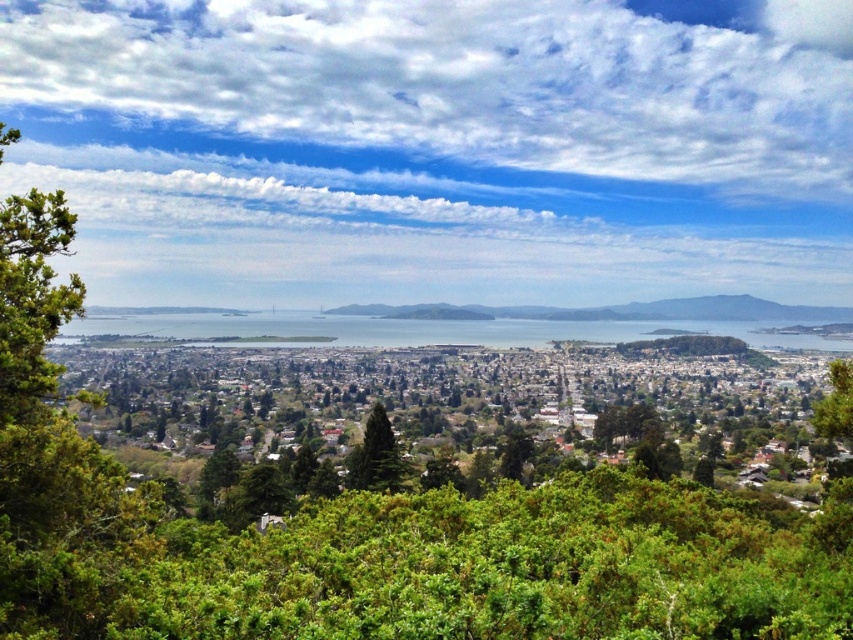
Question: Which of the following is the closest to the observer?

Choices:
 (A) (393, 486)
 (B) (500, 310)
 (C) (515, 460)

Answer: (B)

Question: Can you confirm if green grassy hill at center is positioned to the right of green leafy tree at center?

Choices:
 (A) no
 (B) yes

Answer: (B)

Question: Is green grassy hill at center positioned in front of green leafy tree at center?

Choices:
 (A) yes
 (B) no

Answer: (A)

Question: Can you confirm if green grassy hill at center is bigger than green leafy tree at center?

Choices:
 (A) yes
 (B) no

Answer: (A)

Question: Which of the following is the farthest from the observer?

Choices:
 (A) green matte tree at center
 (B) green grassy hill at center
 (C) green leafy tree at center

Answer: (C)

Question: Which object is farther from the camera taking this photo?

Choices:
 (A) green grassy hill at center
 (B) green matte tree at center

Answer: (B)